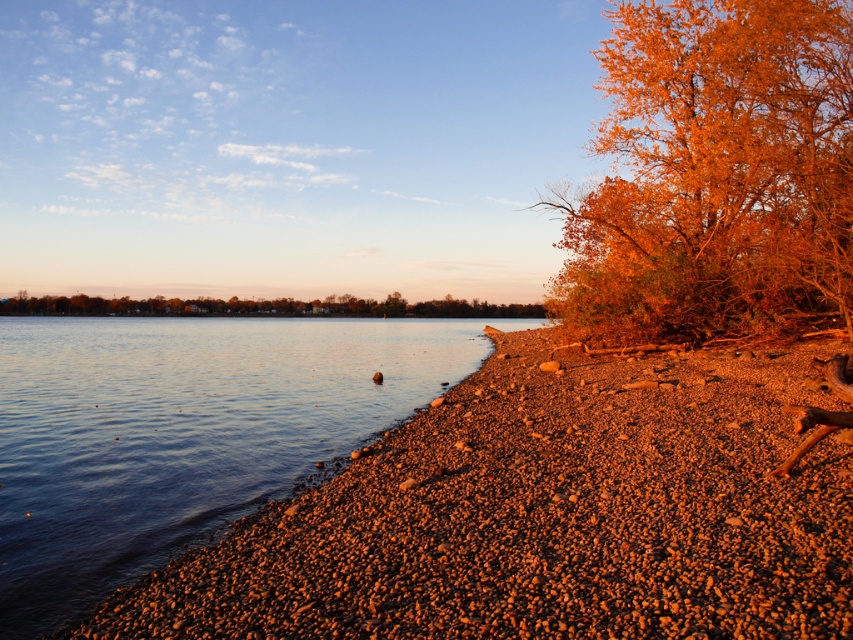
Can you confirm if smooth water at lower left is positioned below orange leafy tree at right?

Yes, smooth water at lower left is below orange leafy tree at right.

Can you confirm if smooth water at lower left is taller than orange leafy tree at right?

No, smooth water at lower left is not taller than orange leafy tree at right.

The image size is (853, 640). Find the location of `smooth water at lower left`. smooth water at lower left is located at coordinates (183, 432).

Looking at this image, measure the distance between smooth water at lower left and orange matte tree at center.

They are 68.11 meters apart.

Does point (310, 465) come closer to viewer compared to point (247, 301)?

Yes, point (310, 465) is in front of point (247, 301).

The image size is (853, 640). I want to click on smooth water at lower left, so click(x=183, y=432).

Does orange leafy tree at right have a smaller size compared to orange matte tree at center?

Yes, orange leafy tree at right is smaller than orange matte tree at center.

Is orange leafy tree at right positioned at the back of orange matte tree at center?

No, orange leafy tree at right is closer to the viewer.

Between point (838, 220) and point (180, 314), which one is positioned in front?

Point (838, 220) is more forward.

At what (x,y) coordinates should I click in order to perform the action: click on orange leafy tree at right. Please return your answer as a coordinate pair (x, y). Looking at the image, I should click on (715, 173).